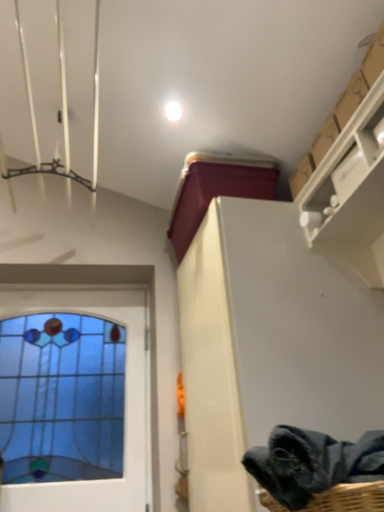
Question: From a real-world perspective, is dark gray fabric at lower right on white glossy droplight at upper center?

Choices:
 (A) no
 (B) yes

Answer: (A)

Question: Can you confirm if dark gray fabric at lower right is positioned to the right of white glossy droplight at upper center?

Choices:
 (A) no
 (B) yes

Answer: (B)

Question: Is dark gray fabric at lower right facing towards white glossy droplight at upper center?

Choices:
 (A) yes
 (B) no

Answer: (B)

Question: Can you confirm if dark gray fabric at lower right is bigger than white glossy droplight at upper center?

Choices:
 (A) no
 (B) yes

Answer: (B)

Question: Is dark gray fabric at lower right facing away from white glossy droplight at upper center?

Choices:
 (A) yes
 (B) no

Answer: (B)

Question: Would you say dark gray fabric at lower right is inside or outside stained glass window at left?

Choices:
 (A) outside
 (B) inside

Answer: (A)

Question: Considering the relative positions of dark gray fabric at lower right and stained glass window at left in the image provided, is dark gray fabric at lower right to the left or to the right of stained glass window at left?

Choices:
 (A) left
 (B) right

Answer: (B)

Question: From their relative heights in the image, would you say dark gray fabric at lower right is taller or shorter than stained glass window at left?

Choices:
 (A) tall
 (B) short

Answer: (B)

Question: From the image's perspective, is dark gray fabric at lower right above or below stained glass window at left?

Choices:
 (A) below
 (B) above

Answer: (B)

Question: Is point (326, 195) positioned closer to the camera than point (288, 424)?

Choices:
 (A) farther
 (B) closer

Answer: (A)

Question: Considering the positions of cardboard at upper right and dark gray fabric at lower right in the image, is cardboard at upper right wider or thinner than dark gray fabric at lower right?

Choices:
 (A) wide
 (B) thin

Answer: (B)

Question: Based on their positions, is cardboard at upper right located to the left or right of dark gray fabric at lower right?

Choices:
 (A) right
 (B) left

Answer: (A)

Question: From the image's perspective, is cardboard at upper right located above or below dark gray fabric at lower right?

Choices:
 (A) above
 (B) below

Answer: (A)

Question: From a real-world perspective, is stained glass window at left positioned above or below white glossy droplight at upper center?

Choices:
 (A) above
 (B) below

Answer: (B)

Question: Considering the positions of point (134, 455) and point (178, 117), is point (134, 455) closer or farther from the camera than point (178, 117)?

Choices:
 (A) closer
 (B) farther

Answer: (B)